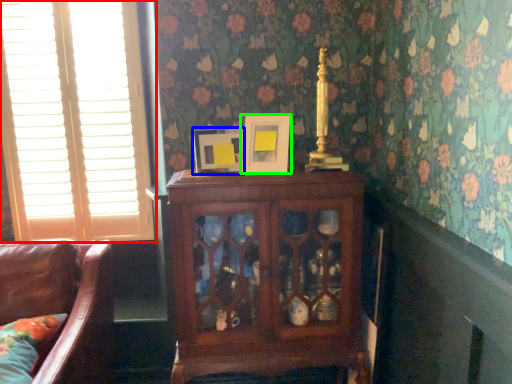
Question: Considering the real-world distances, which object is closest to window (highlighted by a red box)? picture frame (highlighted by a blue box) or picture frame (highlighted by a green box).

Choices:
 (A) picture frame
 (B) picture frame

Answer: (A)